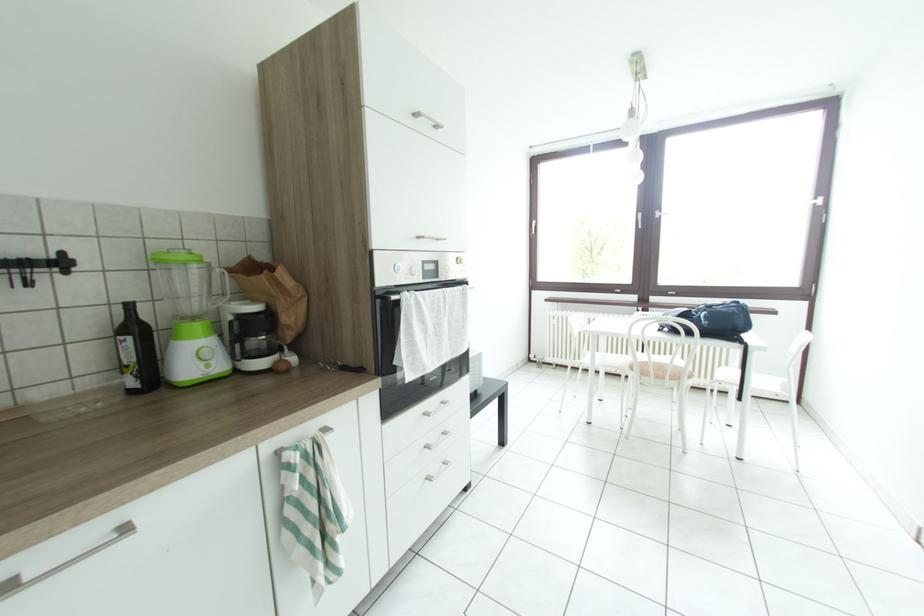
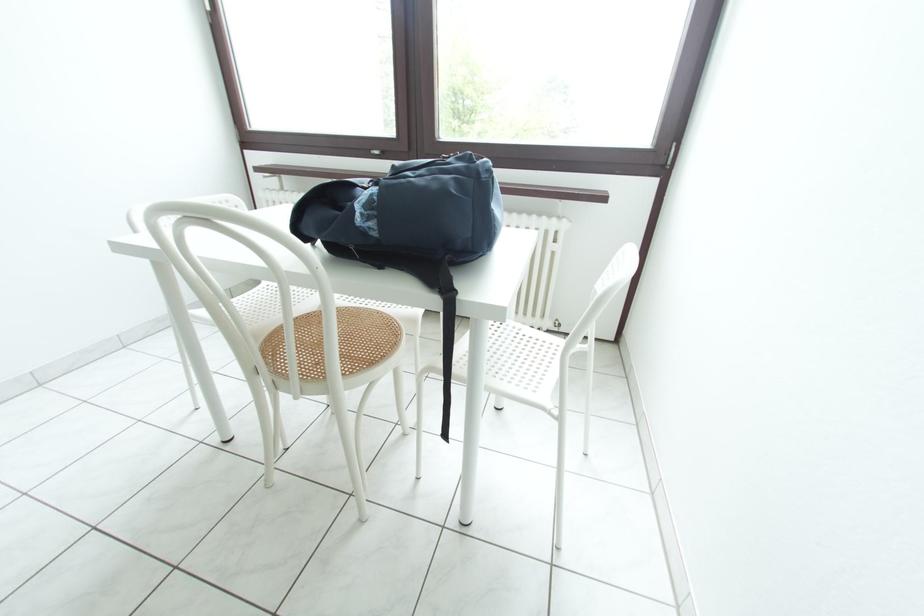
In a continuous first-person perspective shot, in which direction is the camera moving?

The cameraman walked toward right, forward.